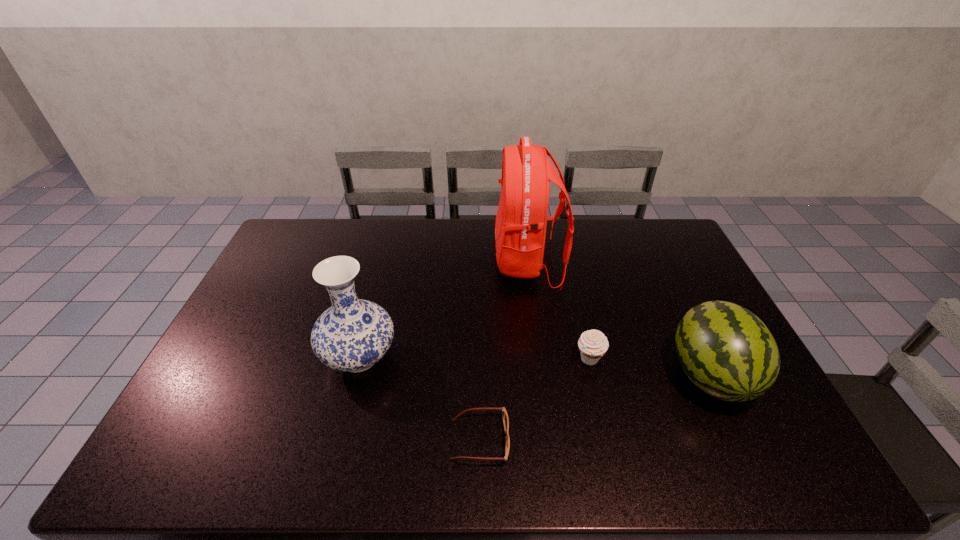
Locate an element on the screen. free space located on the main compartment of the backpack is located at coordinates (481, 262).

You are a GUI agent. You are given a task and a screenshot of the screen. Output one action in this format:
    pyautogui.click(x=<x>, y=<y>)
    Task: Click on the vacant space located on the front of the vase
    The width and height of the screenshot is (960, 540).
    Given the screenshot: What is the action you would take?
    pyautogui.click(x=331, y=467)

Identify the location of vacant space situated at the stem end of the watermelon. (750, 459).

The width and height of the screenshot is (960, 540). I want to click on free space located on the back of the second shortest object, so click(576, 302).

This screenshot has height=540, width=960. I want to click on free space located on the front-facing side of the spectacles, so click(608, 440).

Where is `object located at the far edge`? This screenshot has height=540, width=960. object located at the far edge is located at coordinates (520, 229).

Where is `object that is at the near edge`? object that is at the near edge is located at coordinates (505, 416).

Where is `object present at the right edge`? This screenshot has height=540, width=960. object present at the right edge is located at coordinates (725, 350).

Where is `free region at the far edge`? The height and width of the screenshot is (540, 960). free region at the far edge is located at coordinates (377, 247).

Where is `free space at the near edge of the desktop`? free space at the near edge of the desktop is located at coordinates (702, 462).